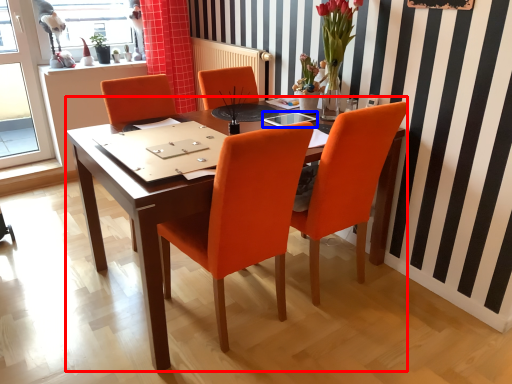
Question: Which point is further to the camera, desk (highlighted by a red box) or glass table (highlighted by a blue box)?

Choices:
 (A) desk
 (B) glass table

Answer: (B)